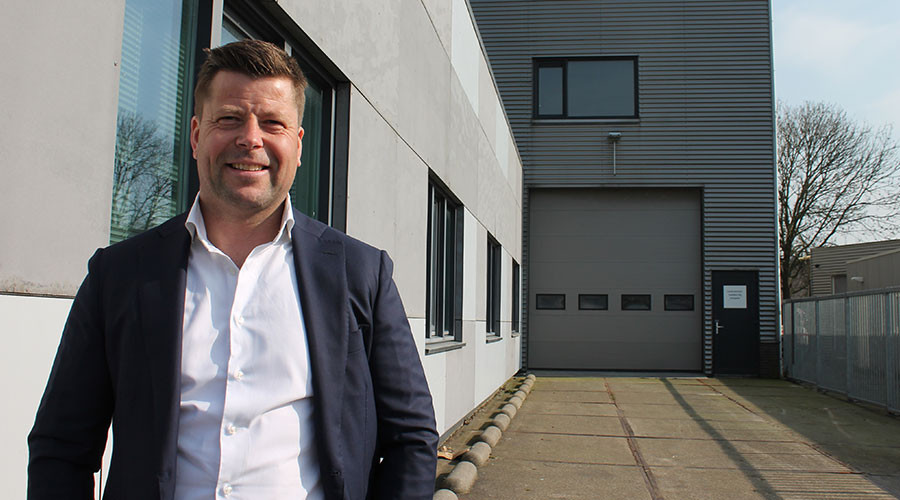
Find the location of a particular element. commercial door is located at coordinates (735, 317).